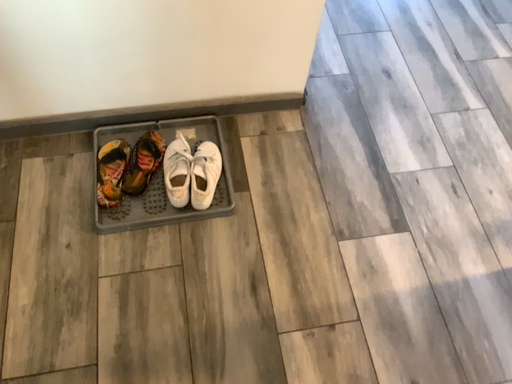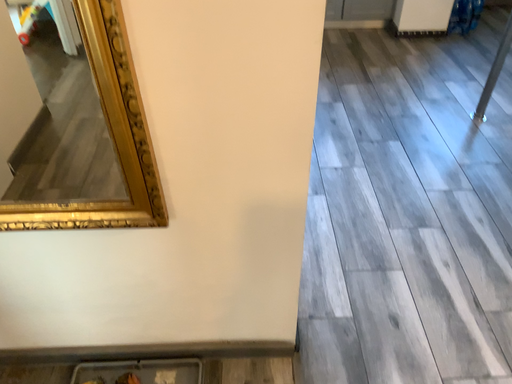
Question: How did the camera likely rotate when shooting the video?

Choices:
 (A) rotated left
 (B) rotated right

Answer: (A)